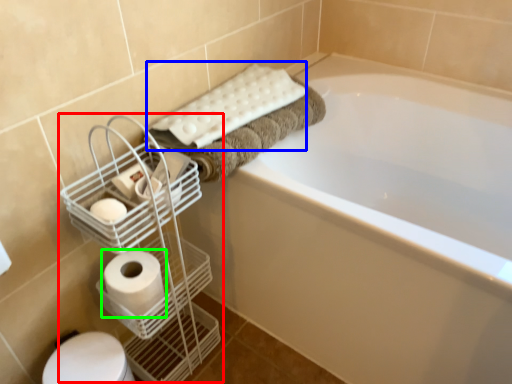
Question: Considering the real-world distances, which object is farthest from bird cage (highlighted by a red box)? bath towel (highlighted by a blue box) or toilet paper (highlighted by a green box)?

Choices:
 (A) bath towel
 (B) toilet paper

Answer: (A)